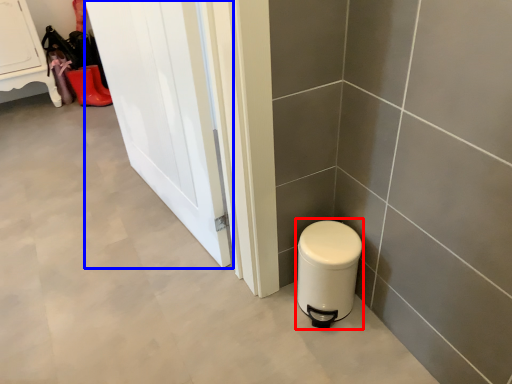
Question: Which of the following is the farthest to the observer, water heater (highlighted by a red box) or door (highlighted by a blue box)?

Choices:
 (A) water heater
 (B) door

Answer: (A)